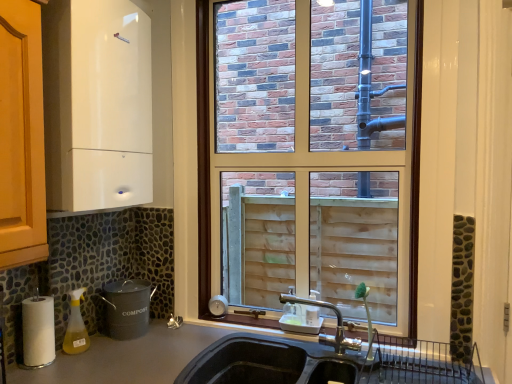
You are a GUI agent. You are given a task and a screenshot of the screen. Output one action in this format:
    pyautogui.click(x=<x>, y=<y>)
    Task: Click on the free space in front of gray matte compost bin at lower left, which ranks as the 3th appliance in top-to-bottom order
    Image resolution: width=512 pixels, height=384 pixels.
    Given the screenshot: What is the action you would take?
    pyautogui.click(x=124, y=341)